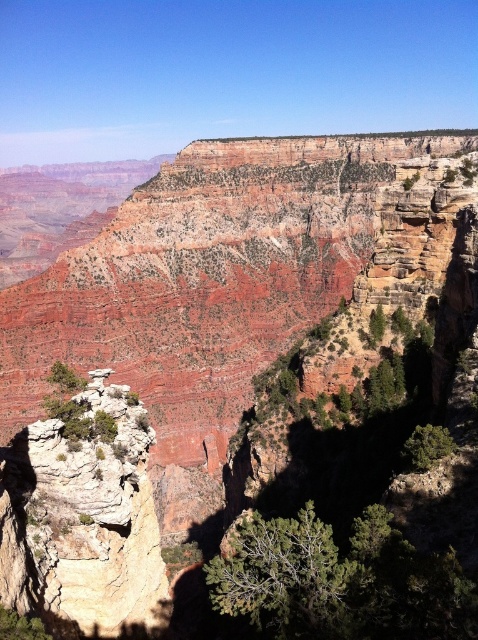
Who is lower down, rustic sandstone rock formation at center-left or green matte tree at lower right?

Positioned lower is rustic sandstone rock formation at center-left.

Does point (78, 424) come farther from viewer compared to point (403, 456)?

No, it is in front of (403, 456).

Find the location of a particular element. The image size is (478, 640). rustic sandstone rock formation at center-left is located at coordinates (84, 516).

Which is more to the right, rustic sandstone rock formation at center-left or green textured tree at lower center?

From the viewer's perspective, green textured tree at lower center appears more on the right side.

Between point (129, 604) and point (315, 628), which one is positioned in front?

Positioned in front is point (315, 628).

Which is behind, point (46, 468) or point (303, 580)?

Positioned behind is point (46, 468).

Find the location of `rustic sandstone rock formation at center-left`. rustic sandstone rock formation at center-left is located at coordinates (84, 516).

Can you confirm if green textured tree at lower center is taller than green matte tree at lower right?

Yes.

Looking at this image, who is taller, green textured tree at lower center or green matte tree at lower right?

With more height is green textured tree at lower center.

Between point (304, 563) and point (426, 422), which one is positioned in front?

Point (304, 563) is in front.

Where is `green textured tree at lower center`? The image size is (478, 640). green textured tree at lower center is located at coordinates (284, 577).